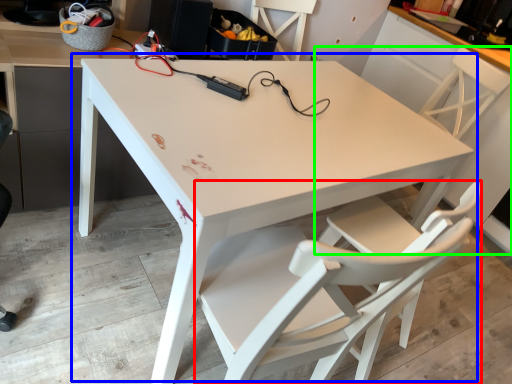
Question: Estimate the real-world distances between objects in this image. Which object is closer to chair (highlighted by a red box), table (highlighted by a blue box) or chair (highlighted by a green box)?

Choices:
 (A) table
 (B) chair

Answer: (A)